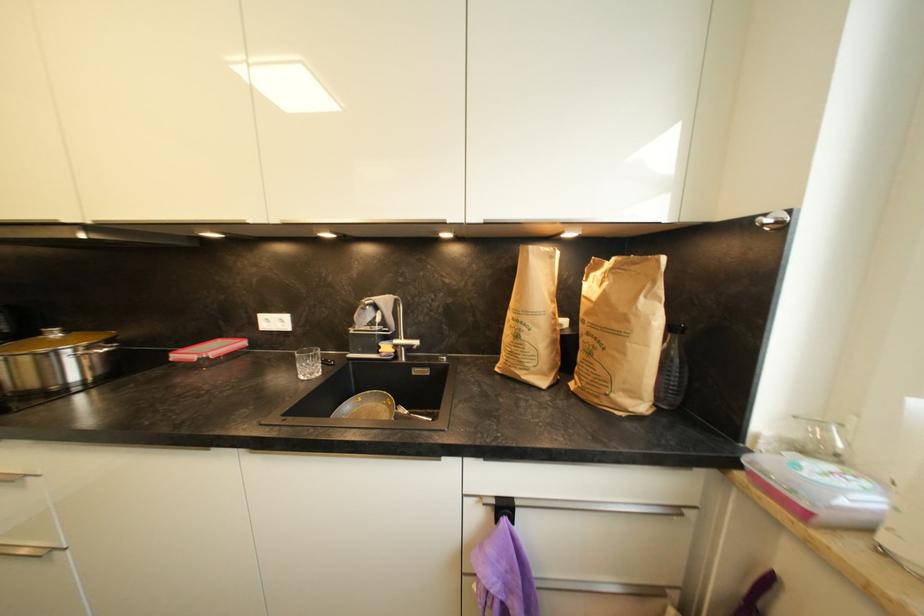
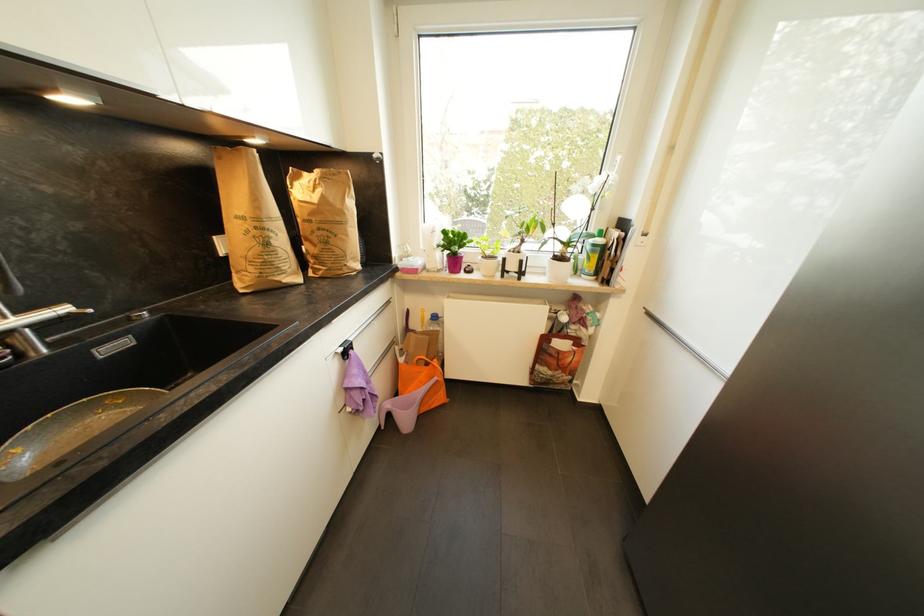
The images are taken continuously from a first-person perspective. In which direction is your viewpoint rotating?

The camera rotated toward right-down.